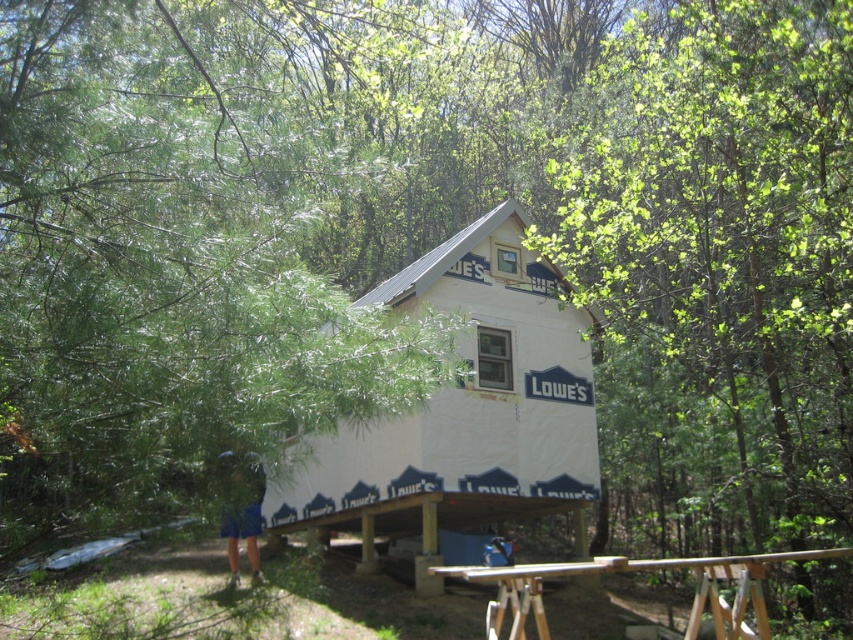
Looking at this image, which is more to the right, green leafy tree at upper left or green leafy tree at upper center?

From the viewer's perspective, green leafy tree at upper center appears more on the right side.

What do you see at coordinates (161, 272) in the screenshot?
I see `green leafy tree at upper left` at bounding box center [161, 272].

Locate an element on the screen. green leafy tree at upper left is located at coordinates (161, 272).

Is green leafy tree at upper left thinner than wooden picnic table at lower center?

Yes, green leafy tree at upper left is thinner than wooden picnic table at lower center.

Who is positioned more to the left, green leafy tree at upper left or wooden picnic table at lower center?

From the viewer's perspective, green leafy tree at upper left appears more on the left side.

At what (x,y) coordinates should I click in order to perform the action: click on green leafy tree at upper left. Please return your answer as a coordinate pair (x, y). This screenshot has height=640, width=853. Looking at the image, I should click on (161, 272).

What are the coordinates of `green leafy tree at upper left` in the screenshot? It's located at (161, 272).

Is green leafy tree at upper center wider than wooden picnic table at lower center?

Yes, green leafy tree at upper center is wider than wooden picnic table at lower center.

Does green leafy tree at upper center have a lesser height compared to wooden picnic table at lower center?

Incorrect, green leafy tree at upper center's height does not fall short of wooden picnic table at lower center's.

Between point (642, 113) and point (755, 564), which one is positioned behind?

Positioned behind is point (642, 113).

Where is `green leafy tree at upper center`? The image size is (853, 640). green leafy tree at upper center is located at coordinates (720, 253).